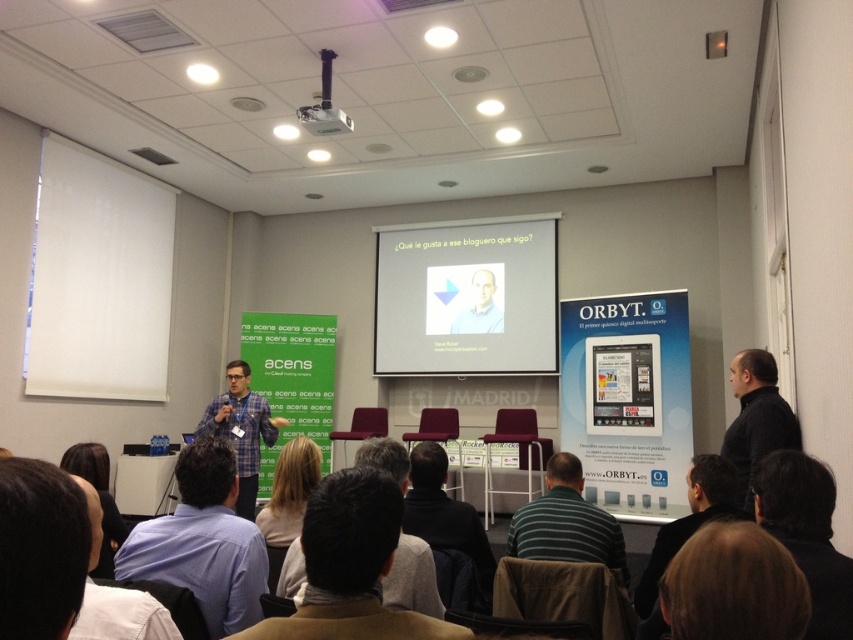
You are standing in the conference room and want to take a photo of the brown hair at lower left. Where should you aim your camera to capture it?

The brown hair at lower left is located at the 2D coordinates point (99, 499), so aim your camera there to capture it.

You are an event organizer setting up for a presentation. You need to ensure that the white matte projector screen at center is visible to all attendees. Considering the brown hair at lower left, which is part of a participant sitting in the front row, will the screen be visible over their head?

The white matte projector screen at center has a larger size compared to brown hair at lower left, so yes, the screen will be visible over the participant with brown hair at lower left because it is larger and likely positioned higher up.